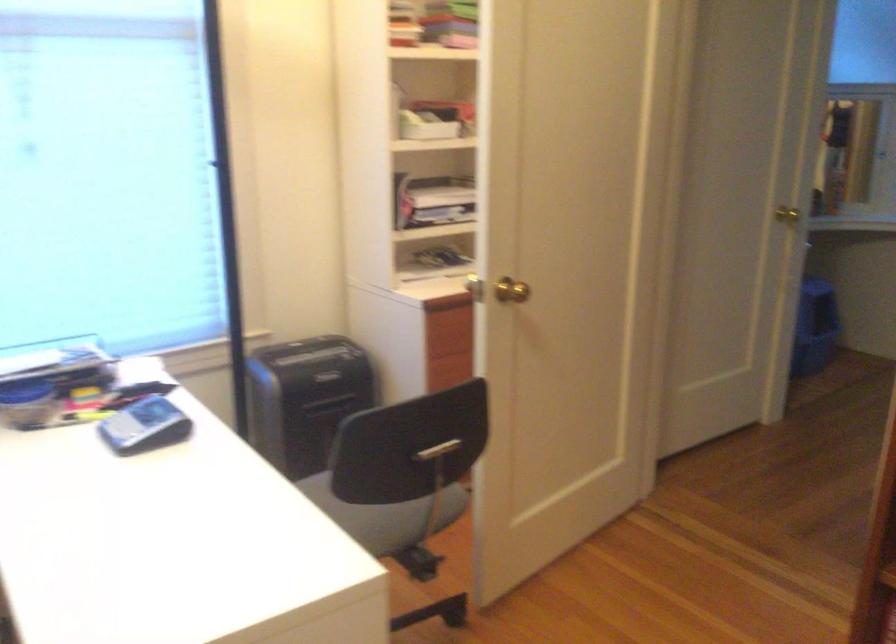
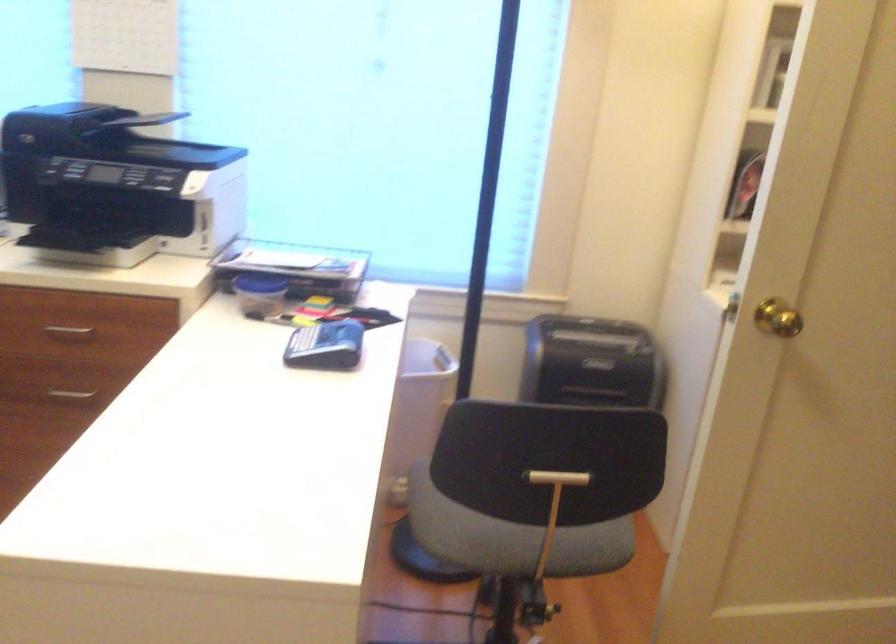
In the second image, find the point that corresponds to (x=410, y=478) in the first image.

(535, 495)